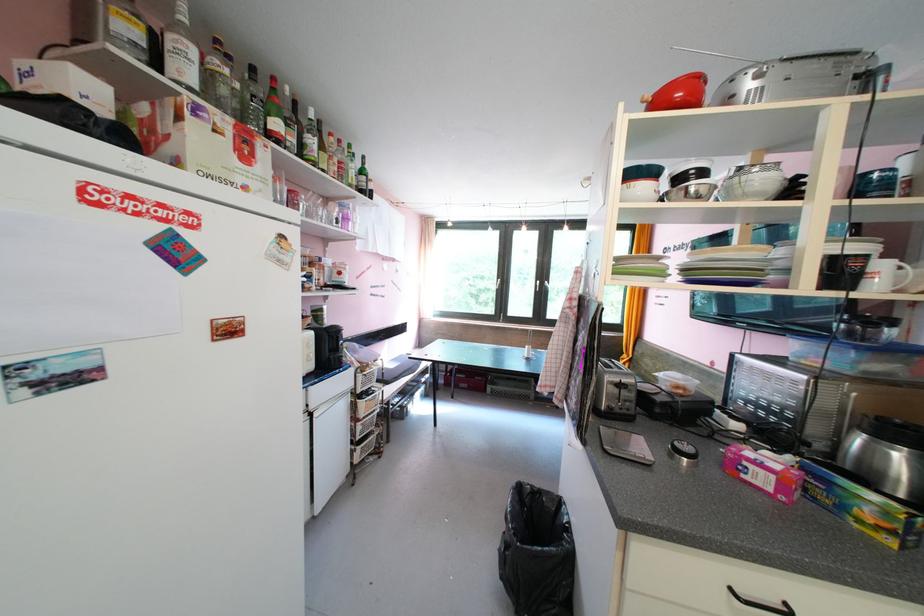
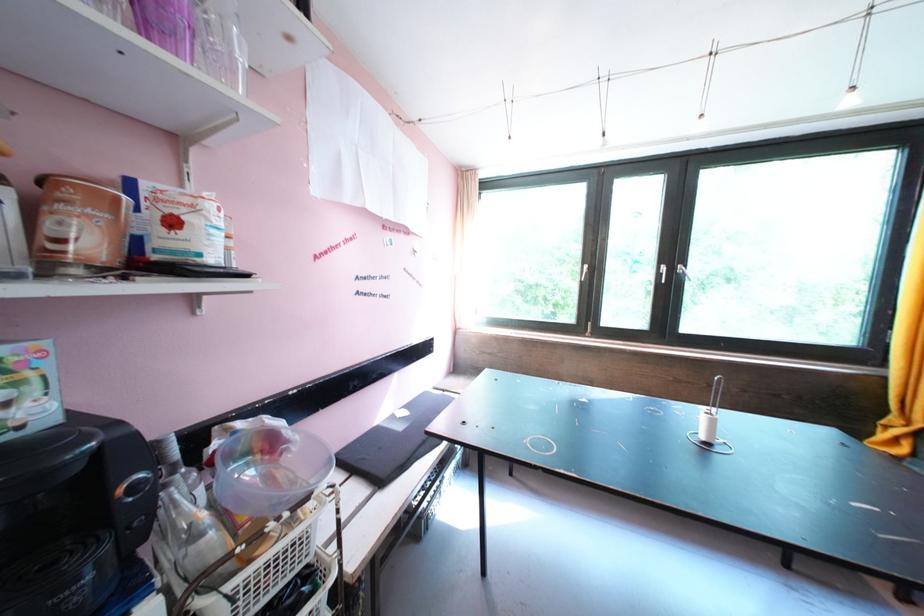
Find the pixel in the second image that matches pixel 348 275 in the first image.

(181, 225)